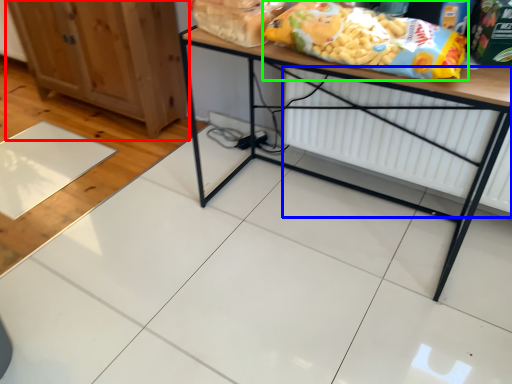
Question: Considering the real-world distances, which object is farthest from cabinetry (highlighted by a red box)? radiator (highlighted by a blue box) or cereal (highlighted by a green box)?

Choices:
 (A) radiator
 (B) cereal

Answer: (B)